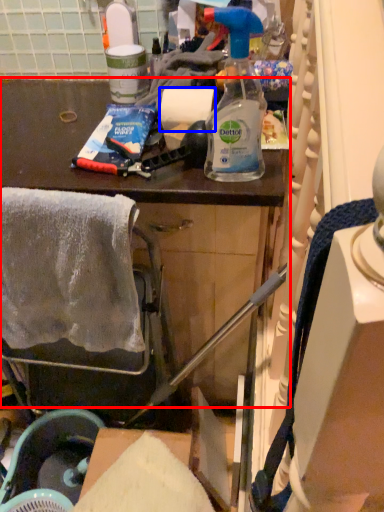
Question: Which of the following is the closest to the observer, cabinetry (highlighted by a red box) or paper towel (highlighted by a blue box)?

Choices:
 (A) cabinetry
 (B) paper towel

Answer: (A)